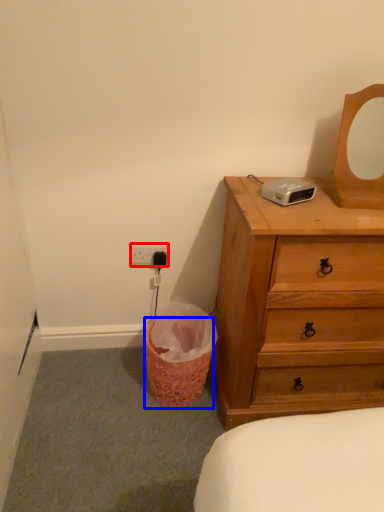
Question: Which object is closer to the camera taking this photo, electric outlet (highlighted by a red box) or basket (highlighted by a blue box)?

Choices:
 (A) electric outlet
 (B) basket

Answer: (B)